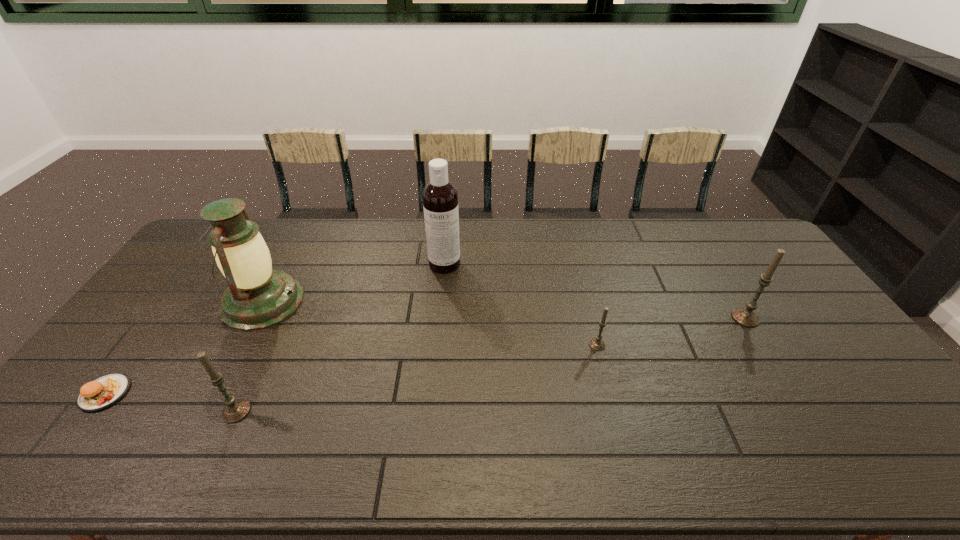
I want to click on the leftmost candle, so click(x=235, y=410).

Where is `the nearest candle`? The height and width of the screenshot is (540, 960). the nearest candle is located at coordinates (235, 410).

Where is `the second nearest candle`? the second nearest candle is located at coordinates (597, 343).

You are a GUI agent. You are given a task and a screenshot of the screen. Output one action in this format:
    pyautogui.click(x=<x>, y=<y>)
    Task: Click on the shortest candle
    The height and width of the screenshot is (540, 960).
    Given the screenshot: What is the action you would take?
    coord(597,343)

I want to click on the farthest candle, so click(x=747, y=317).

Identify the location of the rightmost candle. (747, 317).

Find the location of a particular element. The height and width of the screenshot is (540, 960). dishwasher detergent is located at coordinates (440, 198).

The image size is (960, 540). Identify the location of the farthest object. (440, 198).

At what (x,y) coordinates should I click in order to perform the action: click on lantern. Please return your answer as a coordinate pair (x, y). This screenshot has height=540, width=960. Looking at the image, I should click on click(x=258, y=297).

Find the location of `the leftmost object`. the leftmost object is located at coordinates (103, 392).